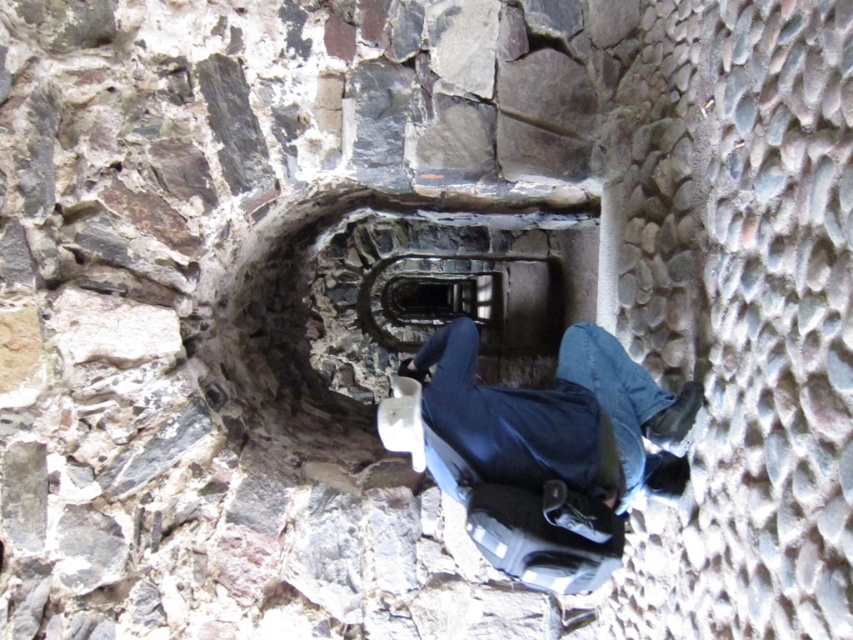
You are a delivery person carrying a heavy box that is 3 feet wide. You need to navigate through the narrow dark stone staircase at center while avoiding the blue denim jeans at center. Is there enough space for you to pass safely?

The blue denim jeans at center and dark stone staircase at center are 4.02 feet apart, so there is enough space for the delivery person to pass safely with their 3 feet wide box.

You are standing at the top of the staircase and want to take a photo of the person descending. Which object, the blue denim jeans at center or the dark stone staircase at center, should you focus on first to ensure it appears sharp in the photo?

The blue denim jeans at center is closer to the viewer than the dark stone staircase at center, so you should focus on the blue denim jeans at center first to ensure it appears sharp in the photo.

You are standing at the bottom of the spiral staircase and want to reach the point marked as point (619, 476). If you take two steps forward, will you reach the point?

The two steps you take would cover a distance of approximately 4.87 feet, which matches the distance between your current position at the bottom and the point (619, 476). Therefore, taking two steps forward should allow you to reach the point.